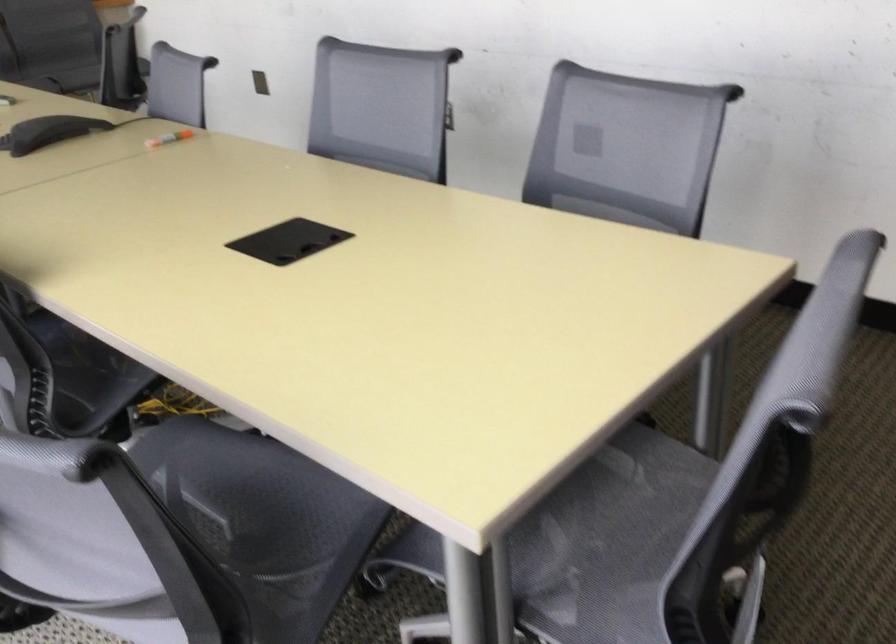
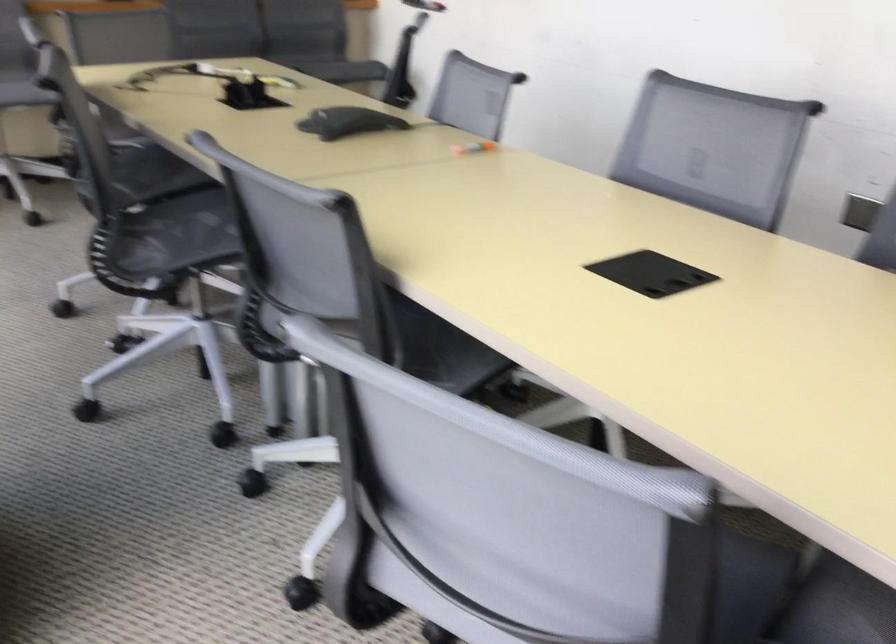
Where in the second image is the point corresponding to the point at 339,518 from the first image?

(718, 583)